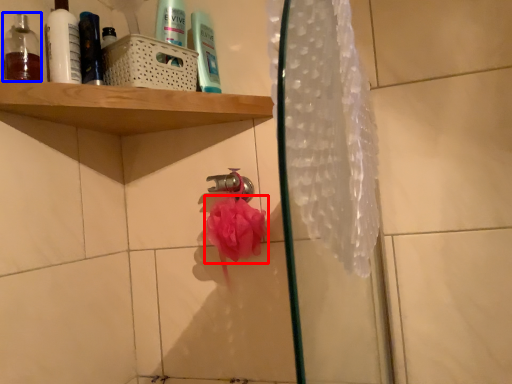
Question: Which object is further to the camera taking this photo, flower (highlighted by a red box) or mouthwash (highlighted by a blue box)?

Choices:
 (A) flower
 (B) mouthwash

Answer: (A)